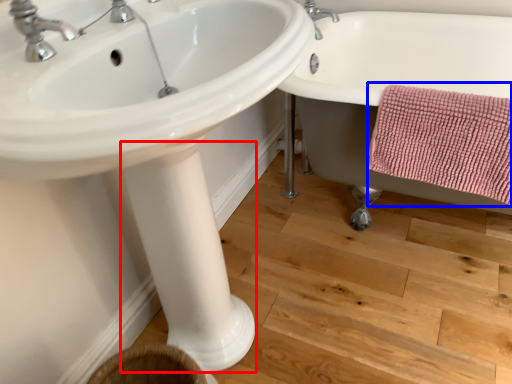
Question: Which point is closer to the camera, pillar (highlighted by a red box) or bath towel (highlighted by a blue box)?

Choices:
 (A) pillar
 (B) bath towel

Answer: (B)